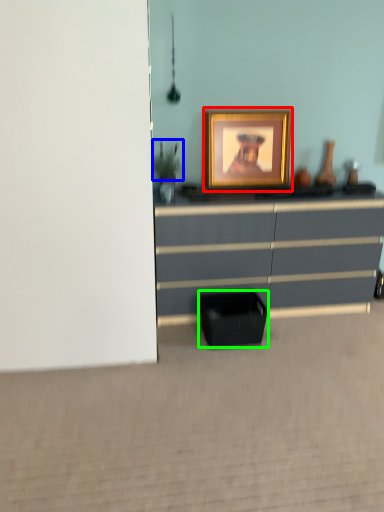
Question: Which is nearer to the picture frame (highlighted by a red box)? plant (highlighted by a blue box) or cabinetry (highlighted by a green box).

Choices:
 (A) plant
 (B) cabinetry

Answer: (A)